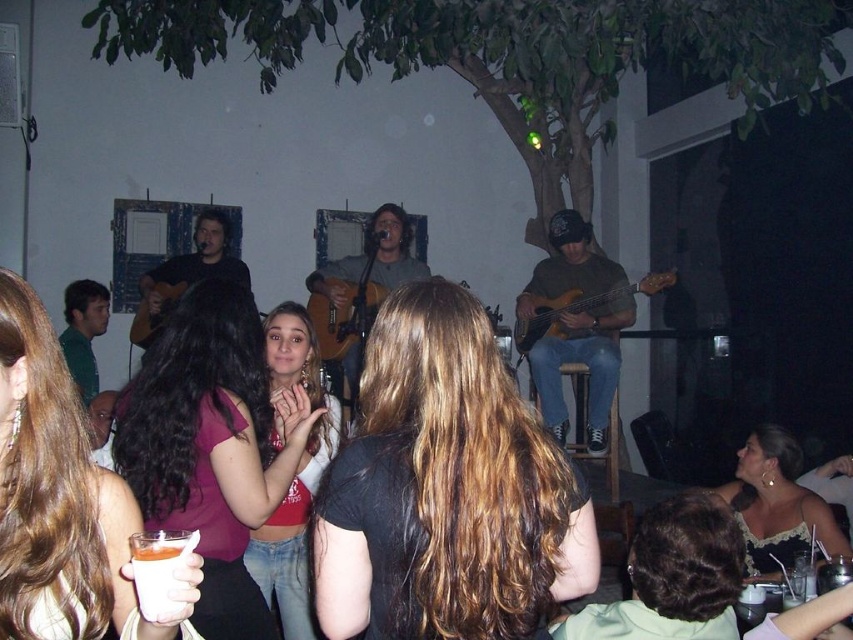
Between point (312, 394) and point (575, 310), which one is positioned in front?

Point (312, 394) is in front.

Can you confirm if matte red shirt at center is positioned to the left of matte brown bass guitar at center?

Indeed, matte red shirt at center is positioned on the left side of matte brown bass guitar at center.

Does point (305, 568) come behind point (657, 273)?

No, (305, 568) is closer to viewer.

Find the location of a particular element. The height and width of the screenshot is (640, 853). matte red shirt at center is located at coordinates (296, 468).

Is point (221, 513) closer to viewer compared to point (154, 563)?

That is False.

Can you confirm if matte pink shirt at center is shorter than white matte cup at lower left?

No.

Find the location of a particular element. The height and width of the screenshot is (640, 853). matte pink shirt at center is located at coordinates (209, 445).

The width and height of the screenshot is (853, 640). Find the location of `brown hair at center`. brown hair at center is located at coordinates (445, 490).

Does brown hair at center have a greater width compared to matte brown bass guitar at center?

In fact, brown hair at center might be narrower than matte brown bass guitar at center.

Is point (525, 490) positioned before point (640, 284)?

Yes, point (525, 490) is closer to viewer.

The image size is (853, 640). Find the location of `brown hair at center`. brown hair at center is located at coordinates pos(445,490).